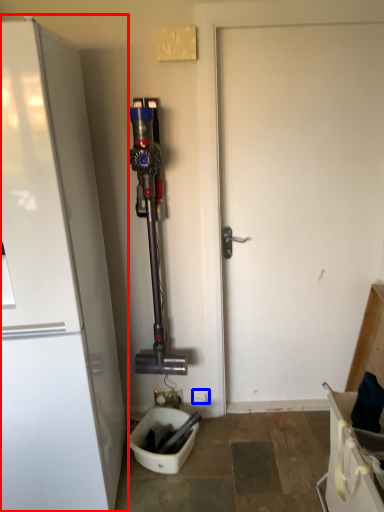
Question: Which object appears farthest to the camera in this image, refrigerator (highlighted by a red box) or electric outlet (highlighted by a blue box)?

Choices:
 (A) refrigerator
 (B) electric outlet

Answer: (B)